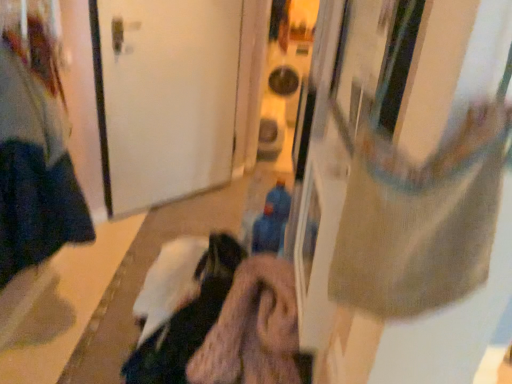
This screenshot has width=512, height=384. I want to click on dark blue fabric at left, so click(x=35, y=157).

The width and height of the screenshot is (512, 384). Describe the element at coordinates (164, 97) in the screenshot. I see `white matte door at center` at that location.

In order to click on dark blue fabric at left in this screenshot , I will do `click(35, 157)`.

Based on the photo, is dark blue fabric at left surrounded by white matte door at center?

No, dark blue fabric at left is located outside of white matte door at center.

Does white matte door at center have a greater width compared to dark blue fabric at left?

Incorrect, the width of white matte door at center does not surpass that of dark blue fabric at left.

Identify the location of door that is under the dark blue fabric at left (from a real-world perspective). (164, 97).

From a real-world perspective, is white matte door at center under blue fabric toy at center?

Correct, in the physical world, white matte door at center is lower than blue fabric toy at center.

Is white matte door at center facing towards blue fabric toy at center?

Yes, white matte door at center faces towards blue fabric toy at center.

How distant is white matte door at center from blue fabric toy at center?

They are 1.45 meters apart.

Considering the positions of objects blue fabric toy at center and white matte door at center in the image provided, who is more to the right, blue fabric toy at center or white matte door at center?

blue fabric toy at center.

From a real-world perspective, who is located lower, blue fabric toy at center or white matte door at center?

white matte door at center, from a real-world perspective.

Is blue fabric toy at center far from white matte door at center?

Indeed, blue fabric toy at center is not near white matte door at center.

From the image's perspective, which one is positioned higher, blue fabric toy at center or white matte door at center?

white matte door at center.

From a real-world perspective, between dark blue fabric at left and blue fabric toy at center, who is vertically lower?

blue fabric toy at center.

Does dark blue fabric at left have a smaller size compared to blue fabric toy at center?

Actually, dark blue fabric at left might be larger than blue fabric toy at center.

From the image's perspective, between dark blue fabric at left and blue fabric toy at center, which one is located above?

dark blue fabric at left, from the image's perspective.

Measure the distance between dark blue fabric at left and blue fabric toy at center.

A distance of 38.16 inches exists between dark blue fabric at left and blue fabric toy at center.

Which point is more distant from viewer, (3, 37) or (104, 83)?

The point (104, 83) is farther from the camera.

From the image's perspective, is dark blue fabric at left under white matte door at center?

Yes, from the image's perspective, dark blue fabric at left is beneath white matte door at center.

From a real-world perspective, is dark blue fabric at left located beneath white matte door at center?

No, from a real-world perspective, dark blue fabric at left is not below white matte door at center.

Can you confirm if dark blue fabric at left is thinner than white matte door at center?

Incorrect, the width of dark blue fabric at left is not less than that of white matte door at center.

Looking at this image, considering the sizes of objects blue fabric toy at center and dark blue fabric at left in the image provided, who is smaller, blue fabric toy at center or dark blue fabric at left?

With smaller size is blue fabric toy at center.

Can you tell me how much blue fabric toy at center and dark blue fabric at left differ in facing direction?

They differ by 179 degrees in their facing directions.

Could you tell me if blue fabric toy at center is turned towards dark blue fabric at left?

Yes, blue fabric toy at center is facing dark blue fabric at left.

Locate an element on the screen. door directly beneath the dark blue fabric at left (from a real-world perspective) is located at coordinates (164, 97).

Locate an element on the screen. Image resolution: width=512 pixels, height=384 pixels. toy on the right of white matte door at center is located at coordinates (272, 221).

When comparing their distances from blue fabric toy at center, does white matte door at center or dark blue fabric at left seem further?

The object further to blue fabric toy at center is white matte door at center.

Estimate the real-world distances between objects in this image. Which object is further from dark blue fabric at left, white matte door at center or blue fabric toy at center?

The object further to dark blue fabric at left is blue fabric toy at center.

From the image, which object appears to be nearer to dark blue fabric at left, blue fabric toy at center or white matte door at center?

white matte door at center is positioned closer to the anchor dark blue fabric at left.

Based on their spatial positions, is dark blue fabric at left or white matte door at center further from blue fabric toy at center?

white matte door at center.

Which object lies further to the anchor point white matte door at center, blue fabric toy at center or dark blue fabric at left?

blue fabric toy at center.

Looking at this image, looking at the image, which one is located further to white matte door at center, dark blue fabric at left or blue fabric toy at center?

blue fabric toy at center lies further to white matte door at center than the other object.

Identify the location of door situated between dark blue fabric at left and blue fabric toy at center from left to right. The height and width of the screenshot is (384, 512). (164, 97).